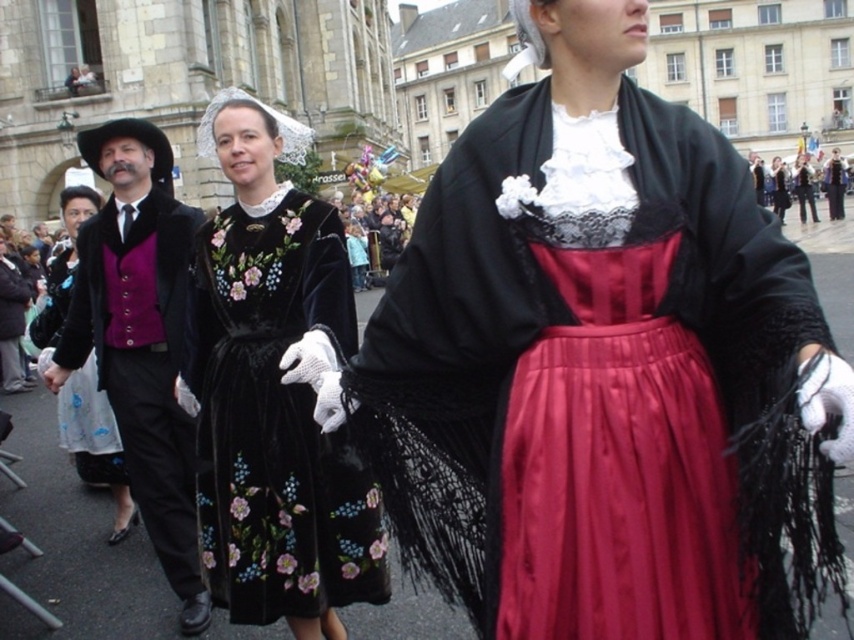
Question: Which of these objects is positioned closest to the satin skirt at center?

Choices:
 (A) silky black skirt at center
 (B) velvet black dress at center
 (C) purple velvet vest at left
 (D) velvet purple vest at left

Answer: (B)

Question: Is velvet black dress at center closer to camera compared to purple velvet vest at left?

Choices:
 (A) no
 (B) yes

Answer: (B)

Question: Can you confirm if silky black dress at center is positioned to the right of silky black skirt at center?

Choices:
 (A) no
 (B) yes

Answer: (B)

Question: Does velvet purple vest at left have a greater width compared to matte black vest at left?

Choices:
 (A) yes
 (B) no

Answer: (A)

Question: Which of the following is the farthest from the observer?

Choices:
 (A) matte black vest at left
 (B) velvet purple vest at left

Answer: (A)

Question: Estimate the real-world distances between objects in this image. Which object is closer to the silky black skirt at center?

Choices:
 (A) velvet black coat at center
 (B) purple velvet vest at left

Answer: (A)